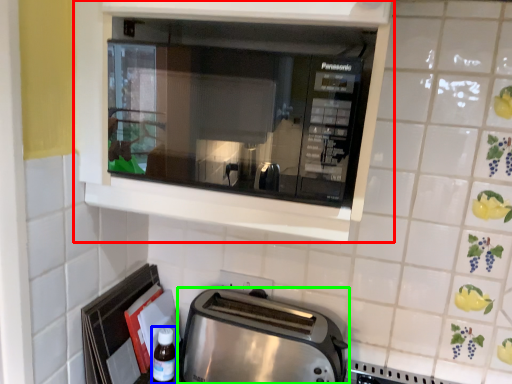
Question: Based on their relative distances, which object is farther from cabinetry (highlighted by a red box)? Choose from bottle (highlighted by a blue box) and toaster (highlighted by a green box).

Choices:
 (A) bottle
 (B) toaster

Answer: (A)